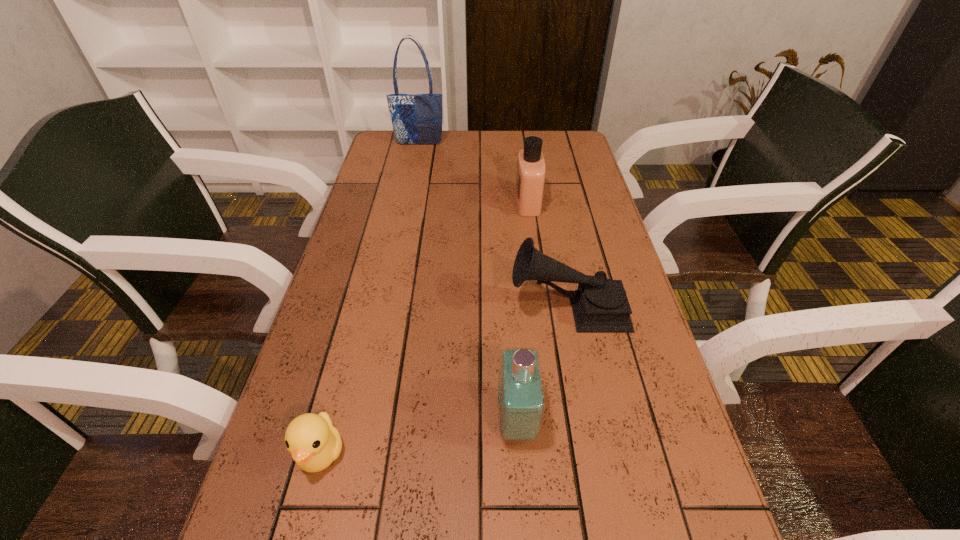
You are a GUI agent. You are given a task and a screenshot of the screen. Output one action in this format:
    pyautogui.click(x=<x>, y=<y>)
    Task: Click on the duck present at the left edge
    The height and width of the screenshot is (540, 960).
    Given the screenshot: What is the action you would take?
    pyautogui.click(x=314, y=443)

Find the location of a particular element. object that is at the right edge is located at coordinates (599, 304).

Where is `object at the far left corner`? This screenshot has width=960, height=540. object at the far left corner is located at coordinates (417, 119).

This screenshot has width=960, height=540. Identify the location of vacant space at the far edge of the desktop. (503, 148).

Identify the location of free spot at the left edge of the desktop. Image resolution: width=960 pixels, height=540 pixels. pos(387,225).

Find the location of a particular element. vacant region at the right edge of the desktop is located at coordinates [x=675, y=420].

Find the location of a particular element. vacant space at the far left corner of the desktop is located at coordinates (412, 160).

The image size is (960, 540). I want to click on vacant area that lies between the phonograph_record and the second farthest object, so click(548, 255).

At what (x,y) coordinates should I click in order to perform the action: click on free space between the right perfume and the nearer perfume. Please return your answer as a coordinate pair (x, y). Looking at the image, I should click on (522, 312).

In order to click on empty location between the phonograph_record and the farthest object in this screenshot , I will do `click(493, 226)`.